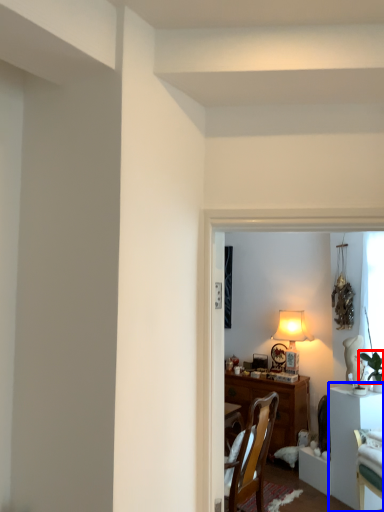
Question: Which object appears closest to the camera in this image, plant (highlighted by a red box) or table (highlighted by a blue box)?

Choices:
 (A) plant
 (B) table

Answer: (B)